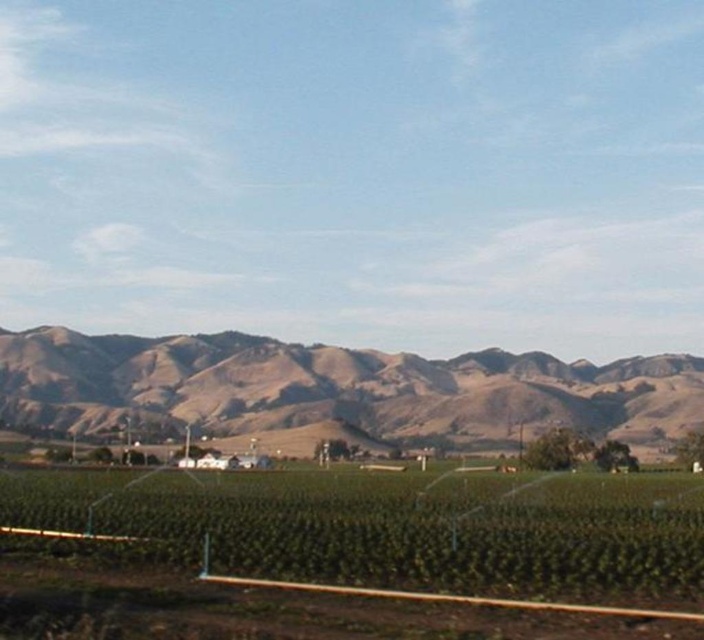
Does green grass at center appear over brown/dry grassy hillside at center?

Yes.

Who is lower down, green grass at center or brown/dry grassy hillside at center?

Positioned lower is brown/dry grassy hillside at center.

Locate an element on the screen. Image resolution: width=704 pixels, height=640 pixels. green grass at center is located at coordinates (352, 552).